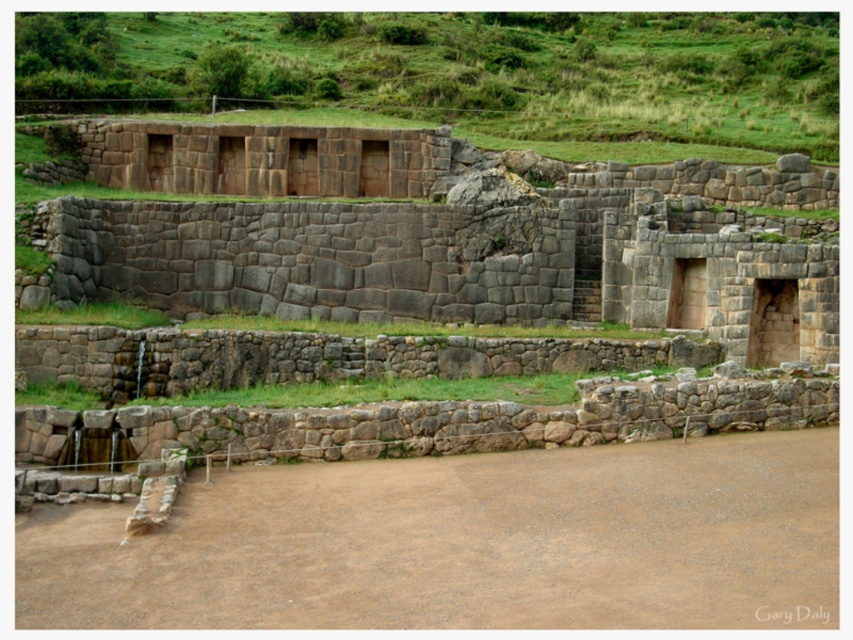
You are standing at the base of the waterfall in the image and want to reach the ancient stone structure. There are two points marked on your map as point 1 at coordinates [763,316] and point 2 at coordinates [786,618]. Which point should you head towards first to stay on the path leading to the structure?

You should head towards point 2 at coordinates [786,618] first because point 1 at coordinates [763,316] is behind it, meaning point 2 is closer to your starting position at the waterfall.

You are a hiker standing at the base of the waterfall. You see the gray stone wall at upper center and the green grass at upper center in the distance. Which one is farther away from you?

The gray stone wall at upper center and the green grass at upper center are 32.08 meters apart from each other, so they are both at the same distance from you since they are positioned at the upper center of the scene.